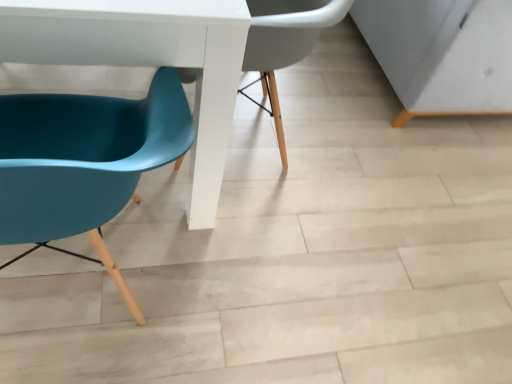
Identify the location of spots to the right of teal plastic chair at left, the 1th chair viewed from the top. (358, 184).